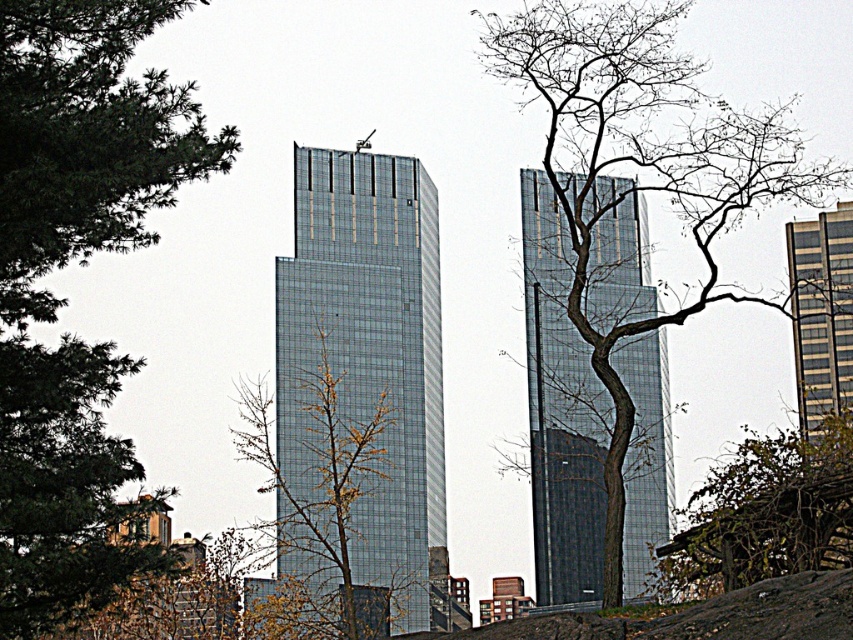
Question: Which point appears farthest from the camera in this image?

Choices:
 (A) (90, 154)
 (B) (358, 394)
 (C) (776, 449)
 (D) (840, 356)

Answer: (B)

Question: Is green leafy tree at left further to the viewer compared to glassy metallic skyscraper at center?

Choices:
 (A) no
 (B) yes

Answer: (A)

Question: Estimate the real-world distances between objects in this image. Which object is farther from the bare branches at center?

Choices:
 (A) gray glass building at right
 (B) green leafy tree at lower right

Answer: (B)

Question: Does glassy metallic skyscraper at center appear over gray glass building at right?

Choices:
 (A) yes
 (B) no

Answer: (B)

Question: Which object appears closest to the camera in this image?

Choices:
 (A) gray glass building at right
 (B) glassy reflective skyscraper at center
 (C) green leafy tree at lower right

Answer: (C)

Question: Is glassy reflective skyscraper at center smaller than gray glass building at right?

Choices:
 (A) yes
 (B) no

Answer: (B)